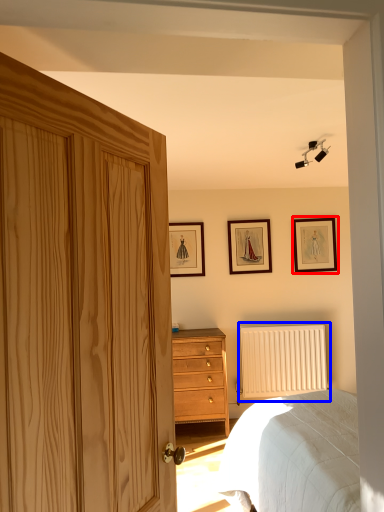
Question: Among these objects, which one is farthest to the camera, picture frame (highlighted by a red box) or radiator (highlighted by a blue box)?

Choices:
 (A) picture frame
 (B) radiator

Answer: (A)